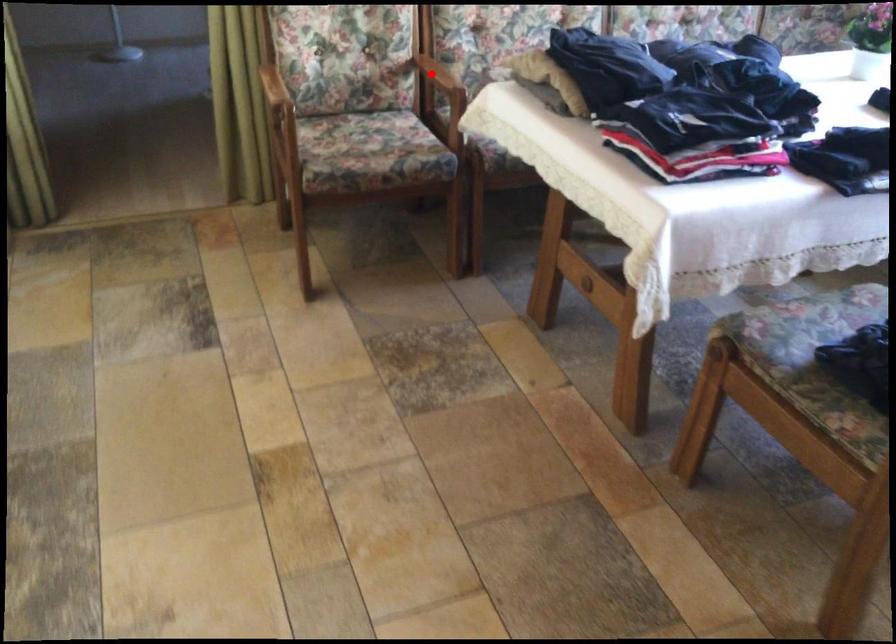
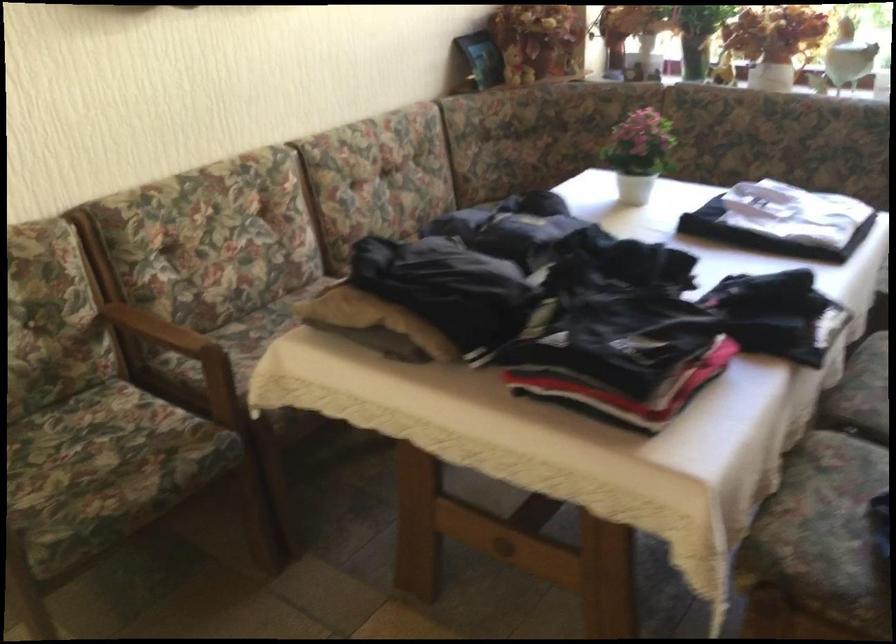
Find the pixel in the second image that matches the highlighted location in the first image.

(158, 328)